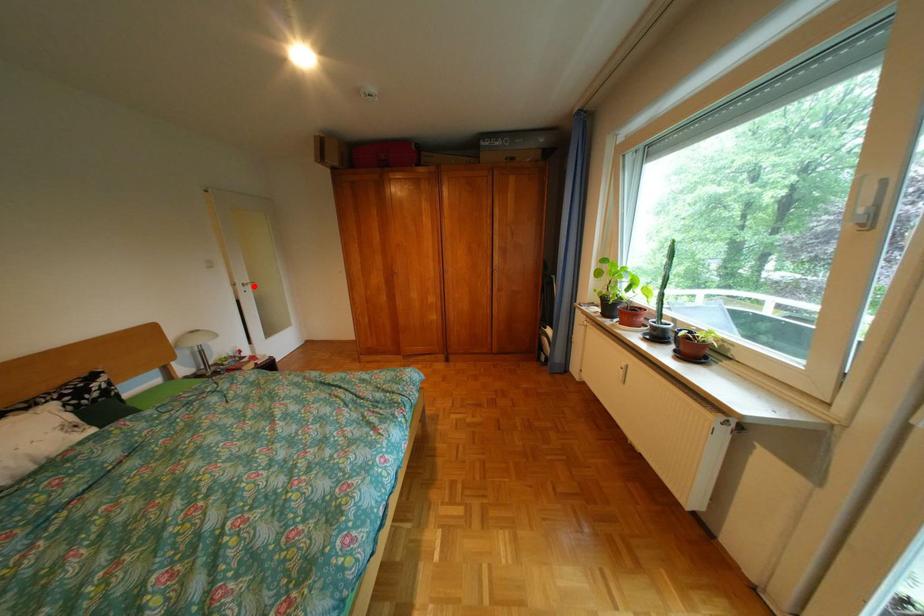
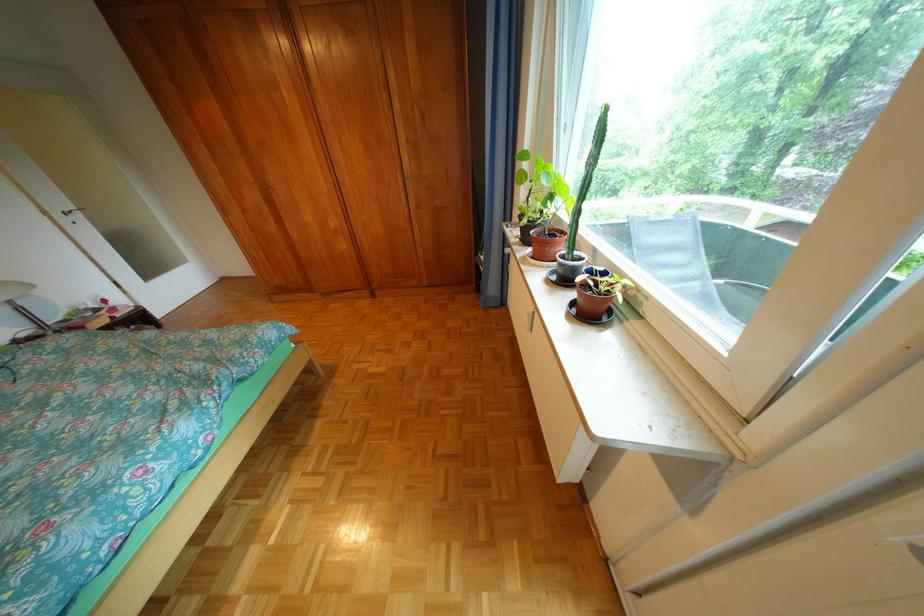
Question: I am providing you with two images of the same scene from different viewpoints. A red point is shown in image1. For the corresponding object point in image2, is it positioned nearer or farther from the camera?

Choices:
 (A) Nearer
 (B) Farther

Answer: (B)